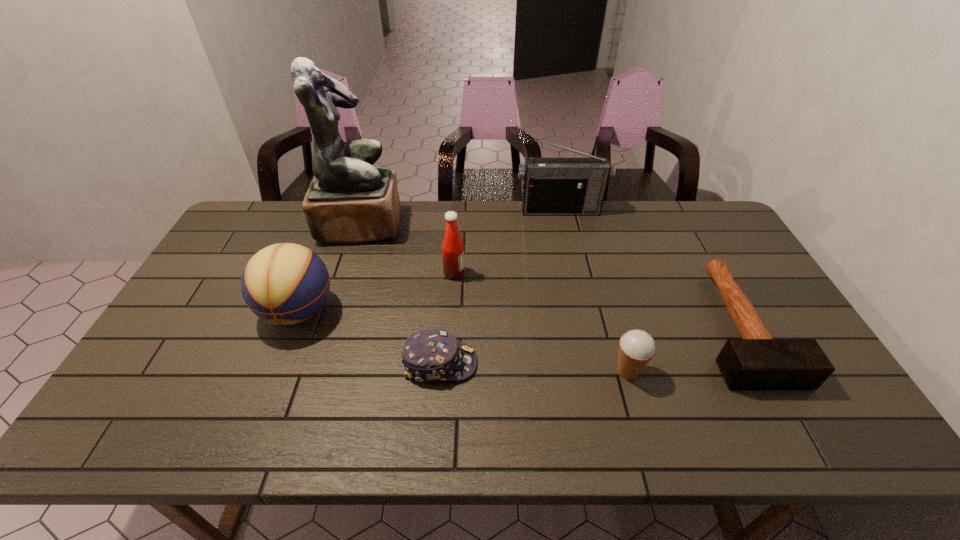
You are a GUI agent. You are given a task and a screenshot of the screen. Output one action in this format:
    pyautogui.click(x=<x>, y=<y>)
    Task: Click on the vacant space situated 0.100m on the patterned surface of the basketball
    
    Given the screenshot: What is the action you would take?
    pyautogui.click(x=274, y=374)

I want to click on free space located on the back of the icecream, so click(602, 281).

What are the coordinates of `vacant space located on the hammer head face of the mallet` in the screenshot? It's located at (791, 426).

Identify the location of blank space located on the front-facing side of the headwear. The height and width of the screenshot is (540, 960). (575, 363).

The height and width of the screenshot is (540, 960). Find the location of `sculpture that is at the far edge`. sculpture that is at the far edge is located at coordinates (349, 201).

Find the location of a particular element. The image size is (960, 540). radio receiver that is at the far edge is located at coordinates (552, 186).

The width and height of the screenshot is (960, 540). Find the location of `object that is at the right edge`. object that is at the right edge is located at coordinates (757, 361).

Where is `vacant area at the far edge`? This screenshot has height=540, width=960. vacant area at the far edge is located at coordinates (516, 232).

In order to click on free region at the near edge in this screenshot , I will do `click(352, 430)`.

This screenshot has width=960, height=540. In order to click on free space at the left edge in this screenshot , I will do `click(180, 374)`.